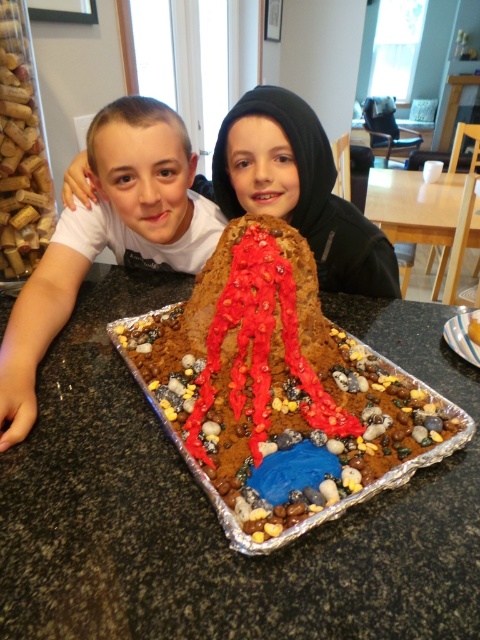
Is point (135, 237) closer to viewer compared to point (430, 216)?

Yes, point (135, 237) is closer to viewer.

What do you see at coordinates (108, 237) in the screenshot? I see `matte white shirt at center` at bounding box center [108, 237].

Between point (26, 294) and point (380, 172), which one is positioned in front?

Positioned in front is point (26, 294).

This screenshot has height=640, width=480. What are the coordinates of `matte white shirt at center` in the screenshot? It's located at (108, 237).

Which is below, chocolate cake at center or matte white shirt at center?

chocolate cake at center is lower down.

Is chocolate cake at center shorter than matte white shirt at center?

Yes, chocolate cake at center is shorter than matte white shirt at center.

Between point (168, 397) and point (56, 330), which one is positioned in front?

Positioned in front is point (168, 397).

This screenshot has width=480, height=640. I want to click on chocolate cake at center, so click(x=280, y=390).

Between chocolate cake at center and matte brown hoodie at upper center, which one is positioned lower?

chocolate cake at center

From the picture: Can you confirm if chocolate cake at center is smaller than matte brown hoodie at upper center?

Actually, chocolate cake at center might be larger than matte brown hoodie at upper center.

Consider the image. Who is more distant from viewer, (301, 413) or (262, 198)?

The point (262, 198) is behind.

Image resolution: width=480 pixels, height=640 pixels. Find the location of `chocolate cake at center`. chocolate cake at center is located at coordinates (280, 390).